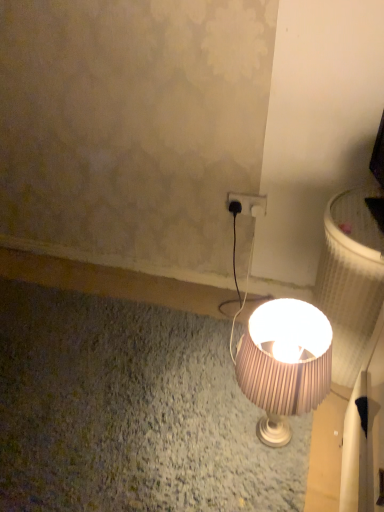
This screenshot has height=512, width=384. What do you see at coordinates (284, 364) in the screenshot?
I see `matte brown lampshade at center` at bounding box center [284, 364].

Identify the location of black plastic plug at center. Image resolution: width=384 pixels, height=512 pixels. (235, 207).

From the image's perspective, relative to black plastic plug at center, is matte brown lampshade at center above or below?

matte brown lampshade at center is below black plastic plug at center.

Between matte brown lampshade at center and black plastic plug at center, which one appears on the right side from the viewer's perspective?

From the viewer's perspective, matte brown lampshade at center appears more on the right side.

Is matte brown lampshade at center closer to the viewer compared to black plastic plug at center?

Yes, it is.

Is matte brown lampshade at center wider than black plastic plug at center?

Indeed, matte brown lampshade at center has a greater width compared to black plastic plug at center.

Considering the relative sizes of black plastic power plug at upper right and matte brown lampshade at center in the image provided, is black plastic power plug at upper right shorter than matte brown lampshade at center?

Yes.

From a real-world perspective, is black plastic power plug at upper right on matte brown lampshade at center?

Yes, from a real-world perspective, black plastic power plug at upper right is over matte brown lampshade at center

Considering the positions of objects black plastic power plug at upper right and matte brown lampshade at center in the image provided, who is in front, black plastic power plug at upper right or matte brown lampshade at center?

matte brown lampshade at center is in front.

Does black plastic power plug at upper right have a smaller size compared to matte brown lampshade at center?

Yes, black plastic power plug at upper right is smaller than matte brown lampshade at center.

Between black plastic plug at center and black plastic power plug at upper right, which one has larger width?

Wider between the two is black plastic plug at center.

Considering the positions of objects black plastic plug at center and black plastic power plug at upper right in the image provided, who is behind, black plastic plug at center or black plastic power plug at upper right?

Positioned behind is black plastic plug at center.

How different are the orientations of black plastic plug at center and black plastic power plug at upper right in degrees?

The angular difference between black plastic plug at center and black plastic power plug at upper right is 0.0875 degrees.

Is black plastic plug at center not inside matte brown lampshade at center?

Yes, black plastic plug at center is outside of matte brown lampshade at center.

Can you tell me how much black plastic plug at center and matte brown lampshade at center differ in facing direction?

They differ by 91.5 degrees in their facing directions.

Is the position of black plastic plug at center more distant than that of matte brown lampshade at center?

That is True.

Is matte brown lampshade at center at the back of black plastic plug at center?

No, black plastic plug at center is not facing the opposite direction of matte brown lampshade at center.

Is black plastic power plug at upper right far away from black plastic plug at center?

No, black plastic power plug at upper right is not far from black plastic plug at center.

Consider the image. From the image's perspective, is black plastic power plug at upper right on black plastic plug at center?

Indeed, from the image's perspective, black plastic power plug at upper right is shown above black plastic plug at center.

From a real-world perspective, who is located lower, black plastic power plug at upper right or black plastic plug at center?

From a 3D spatial view, black plastic plug at center is below.

Relative to black plastic plug at center, is black plastic power plug at upper right in front or behind?

black plastic power plug at upper right is positioned closer to the viewer than black plastic plug at center.

Is matte brown lampshade at center positioned with its back to black plastic power plug at upper right?

No, matte brown lampshade at center is not facing the opposite direction of black plastic power plug at upper right.

Looking at this image, which of these two, matte brown lampshade at center or black plastic power plug at upper right, is bigger?

Bigger between the two is matte brown lampshade at center.

Between matte brown lampshade at center and black plastic power plug at upper right, which one is positioned behind?

black plastic power plug at upper right.

Considering the relative sizes of matte brown lampshade at center and black plastic power plug at upper right in the image provided, is matte brown lampshade at center thinner than black plastic power plug at upper right?

No, matte brown lampshade at center is not thinner than black plastic power plug at upper right.

Where is `lamp located underneath the black plastic plug at center (from a real-world perspective)`? lamp located underneath the black plastic plug at center (from a real-world perspective) is located at coordinates (284, 364).

Find the location of `lamp below the black plastic power plug at upper right (from the image's perspective)`. lamp below the black plastic power plug at upper right (from the image's perspective) is located at coordinates (284, 364).

Considering their positions, is matte brown lampshade at center positioned closer to black plastic power plug at upper right than black plastic plug at center?

Based on the image, black plastic plug at center appears to be nearer to black plastic power plug at upper right.

From the image, which object appears to be nearer to black plastic plug at center, matte brown lampshade at center or black plastic power plug at upper right?

black plastic power plug at upper right.

When comparing their distances from matte brown lampshade at center, does black plastic power plug at upper right or black plastic plug at center seem closer?

The object closer to matte brown lampshade at center is black plastic power plug at upper right.

Which object lies further to the anchor point black plastic power plug at upper right, black plastic plug at center or matte brown lampshade at center?

matte brown lampshade at center is positioned further to the anchor black plastic power plug at upper right.

Based on their spatial positions, is black plastic power plug at upper right or matte brown lampshade at center closer to black plastic plug at center?

black plastic power plug at upper right is closer to black plastic plug at center.

Considering their positions, is black plastic plug at center positioned further to matte brown lampshade at center than black plastic power plug at upper right?

black plastic plug at center.

The width and height of the screenshot is (384, 512). Find the location of `power plugs and sockets between matte brown lampshade at center and black plastic plug at center in the front-back direction`. power plugs and sockets between matte brown lampshade at center and black plastic plug at center in the front-back direction is located at coordinates (250, 203).